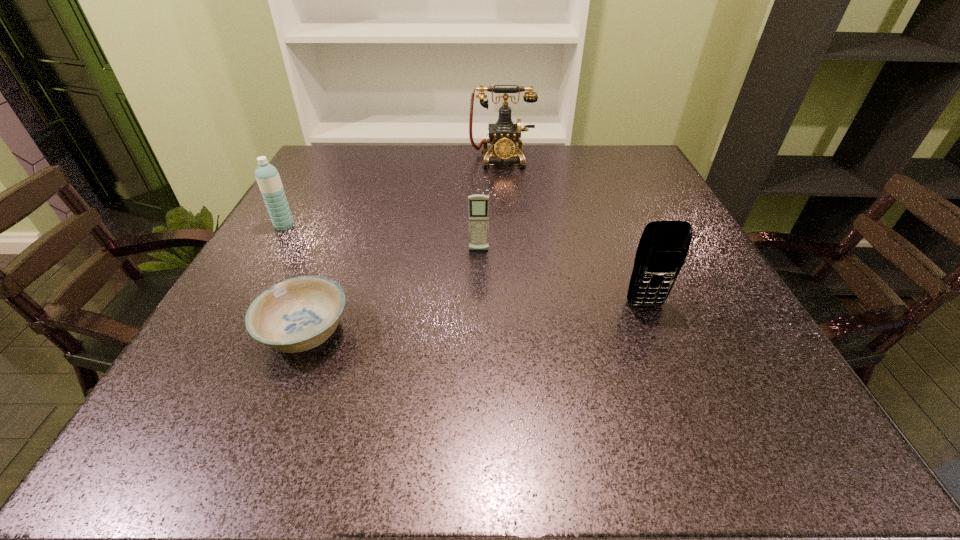
Where is `vacant space located 0.050m on the screen of the right cellular telephone`? The height and width of the screenshot is (540, 960). vacant space located 0.050m on the screen of the right cellular telephone is located at coordinates (657, 332).

Locate an element on the screen. This screenshot has height=540, width=960. vacant space located 0.080m on the back of the water bottle is located at coordinates click(x=299, y=202).

Locate an element on the screen. The width and height of the screenshot is (960, 540). vacant space located 0.240m on the front-facing side of the left cellular telephone is located at coordinates (478, 342).

This screenshot has height=540, width=960. What are the coordinates of `vacant space located on the right of the shortest object` in the screenshot? It's located at (582, 333).

Locate an element on the screen. object at the far edge is located at coordinates (504, 134).

Where is `water bottle at the left edge`? The height and width of the screenshot is (540, 960). water bottle at the left edge is located at coordinates (268, 178).

The width and height of the screenshot is (960, 540). Find the location of `bowl that is positioned at the left edge`. bowl that is positioned at the left edge is located at coordinates (300, 313).

Where is `object that is at the right edge`? This screenshot has height=540, width=960. object that is at the right edge is located at coordinates (663, 247).

You are a GUI agent. You are given a task and a screenshot of the screen. Output one action in this format:
    pyautogui.click(x=<x>, y=<y>)
    Task: Click on the vacant space at the far edge of the desktop
    Image resolution: width=960 pixels, height=540 pixels.
    Given the screenshot: What is the action you would take?
    pyautogui.click(x=382, y=170)

You are a GUI agent. You are given a task and a screenshot of the screen. Output one action in this format:
    pyautogui.click(x=<x>, y=<y>)
    Task: Click on the vacant region at the near edge of the desktop
    The width and height of the screenshot is (960, 540).
    Given the screenshot: What is the action you would take?
    pyautogui.click(x=272, y=449)